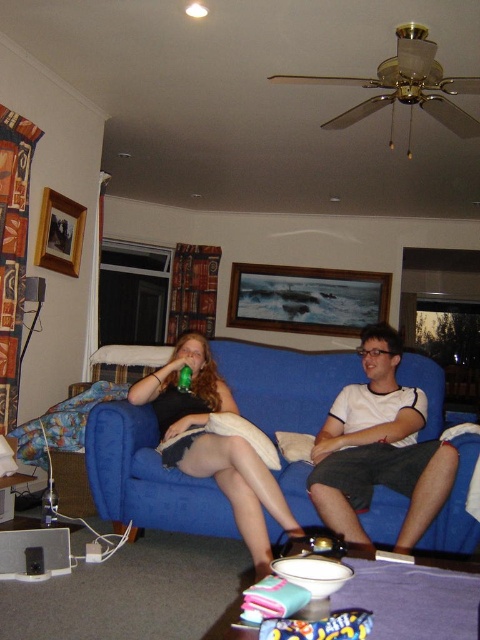
Based on the photo, you are standing in the living room and want to sit down on the blue fabric couch at center. However, there is a matte black dress at center in your way. Can you move the dress to the side to access the couch?

The blue fabric couch at center is below the matte black dress at center. Since the couch is positioned lower than the dress, you can move the dress aside to access the couch.